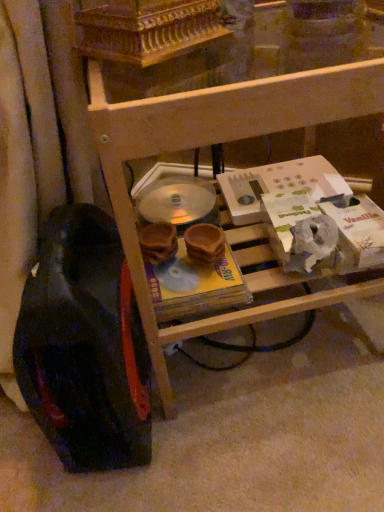
Question: Is black rubber wheel at lower left wider than wooden shelf at center?

Choices:
 (A) no
 (B) yes

Answer: (A)

Question: Is black rubber wheel at lower left with wooden shelf at center?

Choices:
 (A) no
 (B) yes

Answer: (A)

Question: Considering the relative sizes of black rubber wheel at lower left and wooden shelf at center in the image provided, is black rubber wheel at lower left bigger than wooden shelf at center?

Choices:
 (A) no
 (B) yes

Answer: (A)

Question: Is black rubber wheel at lower left oriented away from wooden shelf at center?

Choices:
 (A) yes
 (B) no

Answer: (B)

Question: Is the position of black rubber wheel at lower left more distant than that of wooden shelf at center?

Choices:
 (A) no
 (B) yes

Answer: (B)

Question: Does black rubber wheel at lower left come in front of wooden shelf at center?

Choices:
 (A) no
 (B) yes

Answer: (A)

Question: Does wooden shelf at center appear on the left side of black rubber wheel at lower left?

Choices:
 (A) no
 (B) yes

Answer: (A)

Question: Is wooden shelf at center located outside black rubber wheel at lower left?

Choices:
 (A) no
 (B) yes

Answer: (B)

Question: Considering the relative sizes of wooden shelf at center and black rubber wheel at lower left in the image provided, is wooden shelf at center taller than black rubber wheel at lower left?

Choices:
 (A) yes
 (B) no

Answer: (A)

Question: Is wooden shelf at center surrounding black rubber wheel at lower left?

Choices:
 (A) no
 (B) yes

Answer: (A)

Question: From the image's perspective, is wooden shelf at center above black rubber wheel at lower left?

Choices:
 (A) no
 (B) yes

Answer: (B)

Question: Is wooden shelf at center oriented away from black rubber wheel at lower left?

Choices:
 (A) yes
 (B) no

Answer: (B)

Question: From a real-world perspective, is black rubber wheel at lower left physically located above or below wooden shelf at center?

Choices:
 (A) above
 (B) below

Answer: (B)